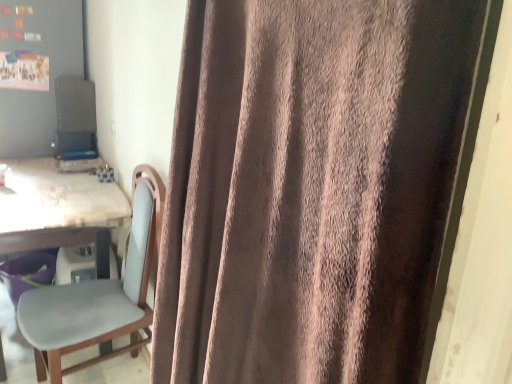
Question: Is matte gray bulletin board at upper left bigger or smaller than wooden table at left?

Choices:
 (A) big
 (B) small

Answer: (A)

Question: Is matte gray bulletin board at upper left to the left or to the right of wooden table at left in the image?

Choices:
 (A) left
 (B) right

Answer: (A)

Question: Which of these objects is positioned farthest from the brown velvety curtain at center?

Choices:
 (A) wooden table at left
 (B) matte gray bulletin board at upper left

Answer: (B)

Question: Which is nearer to the matte gray bulletin board at upper left?

Choices:
 (A) brown velvety curtain at center
 (B) wooden table at left

Answer: (B)